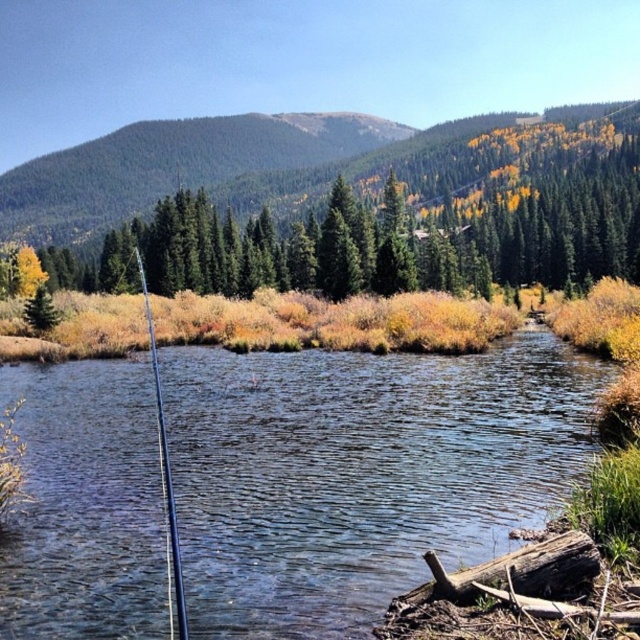
You are an artist planning to paint this scene. You want to ensure the green matte tree at upper center and the silver metallic fishing pole at center are proportionally accurate. Which object should you draw wider?

The green matte tree at upper center should be drawn wider since its width is larger than the silver metallic fishing pole at center.

You are standing at the edge of the water in the image. There is a clear water at center at point [362,474]. If you want to reach the clear water at center, which direction should you move in relation to the fallen log on the right side of the frame?

The clear water at center is located at point [362,474]. Since the fallen log is on the right side of the frame, you should move towards the center from the edge, away from the fallen log on the right side to reach the clear water at center.

You are a hiker who wants to cross the clear water at center. You have a map showing the green matte tree at upper center as a landmark. Based on the scene, which object appears narrower when viewed from above?

The clear water at center appears narrower than the green matte tree at upper center when viewed from above since it is described as thinner.